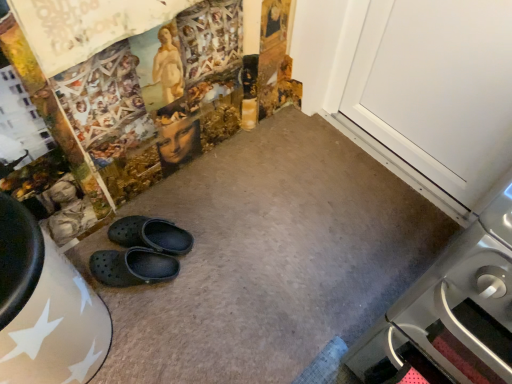
Question: Which is correct: stainless steel oven at lower right is inside black rubber clogs at center, placed as the 2th footwear when sorted from top to bottom, or outside of it?

Choices:
 (A) outside
 (B) inside

Answer: (A)

Question: Would you say stainless steel oven at lower right is to the left or to the right of black rubber clogs at center, the first footwear ordered from the bottom, in the picture?

Choices:
 (A) left
 (B) right

Answer: (B)

Question: Which of these objects is positioned closest to the white smooth door at upper right?

Choices:
 (A) black rubber clogs at center, the first footwear ordered from the bottom
 (B) stainless steel oven at lower right
 (C) black rubber clogs at lower left, which appears as the first footwear when viewed from the top

Answer: (B)

Question: Which of these objects is positioned closest to the stainless steel oven at lower right?

Choices:
 (A) black rubber clogs at lower left, which appears as the first footwear when viewed from the top
 (B) black rubber clogs at center, the first footwear ordered from the bottom
 (C) white smooth door at upper right

Answer: (C)